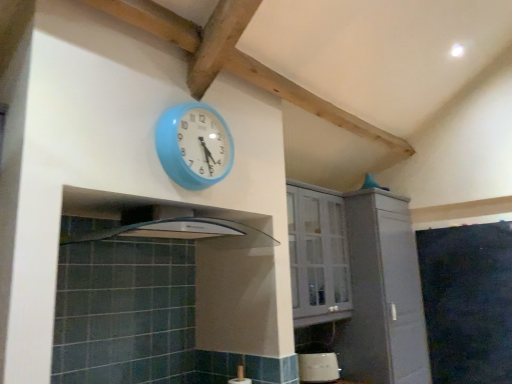
Question: Does black matte chalkboard at right have a greater height compared to white glossy toaster at lower center?

Choices:
 (A) no
 (B) yes

Answer: (B)

Question: Is black matte chalkboard at right to the left of white glossy toaster at lower center from the viewer's perspective?

Choices:
 (A) no
 (B) yes

Answer: (A)

Question: Is black matte chalkboard at right facing away from white glossy toaster at lower center?

Choices:
 (A) no
 (B) yes

Answer: (A)

Question: Is black matte chalkboard at right further to camera compared to white glossy toaster at lower center?

Choices:
 (A) no
 (B) yes

Answer: (A)

Question: Is black matte chalkboard at right located outside white glossy toaster at lower center?

Choices:
 (A) no
 (B) yes

Answer: (B)

Question: Is white matte cabinet at center, which is counted as the 2th cabinetry, starting from the left, wider or thinner than white glossy toaster at lower center?

Choices:
 (A) thin
 (B) wide

Answer: (B)

Question: From a real-world perspective, relative to white glossy toaster at lower center, is white matte cabinet at center, which is counted as the 2th cabinetry, starting from the left, vertically above or below?

Choices:
 (A) above
 (B) below

Answer: (A)

Question: From their relative heights in the image, would you say white matte cabinet at center, which is the first cabinetry in right-to-left order, is taller or shorter than white glossy toaster at lower center?

Choices:
 (A) short
 (B) tall

Answer: (B)

Question: From the image's perspective, is white matte cabinet at center, which is the first cabinetry in right-to-left order, located above or below white glossy toaster at lower center?

Choices:
 (A) above
 (B) below

Answer: (A)

Question: Relative to white glossy cabinet at upper center, which is counted as the 2th cabinetry, starting from the right, is white matte cabinet at center, which is the first cabinetry in right-to-left order, in front or behind?

Choices:
 (A) behind
 (B) front

Answer: (A)

Question: Is white matte cabinet at center, which is the first cabinetry in right-to-left order, spatially inside white glossy cabinet at upper center, positioned as the 1th cabinetry in left-to-right order, or outside of it?

Choices:
 (A) outside
 (B) inside

Answer: (A)

Question: In terms of height, does white matte cabinet at center, which is counted as the 2th cabinetry, starting from the left, look taller or shorter compared to white glossy cabinet at upper center, positioned as the 1th cabinetry in left-to-right order?

Choices:
 (A) short
 (B) tall

Answer: (B)

Question: Looking at their shapes, would you say white matte cabinet at center, which is the first cabinetry in right-to-left order, is wider or thinner than white glossy cabinet at upper center, positioned as the 1th cabinetry in left-to-right order?

Choices:
 (A) wide
 (B) thin

Answer: (A)

Question: In terms of height, does white glossy toaster at lower center look taller or shorter compared to white glossy cabinet at upper center, positioned as the 1th cabinetry in left-to-right order?

Choices:
 (A) short
 (B) tall

Answer: (A)

Question: From a real-world perspective, is white glossy toaster at lower center physically located above or below white glossy cabinet at upper center, which is counted as the 2th cabinetry, starting from the right?

Choices:
 (A) above
 (B) below

Answer: (B)